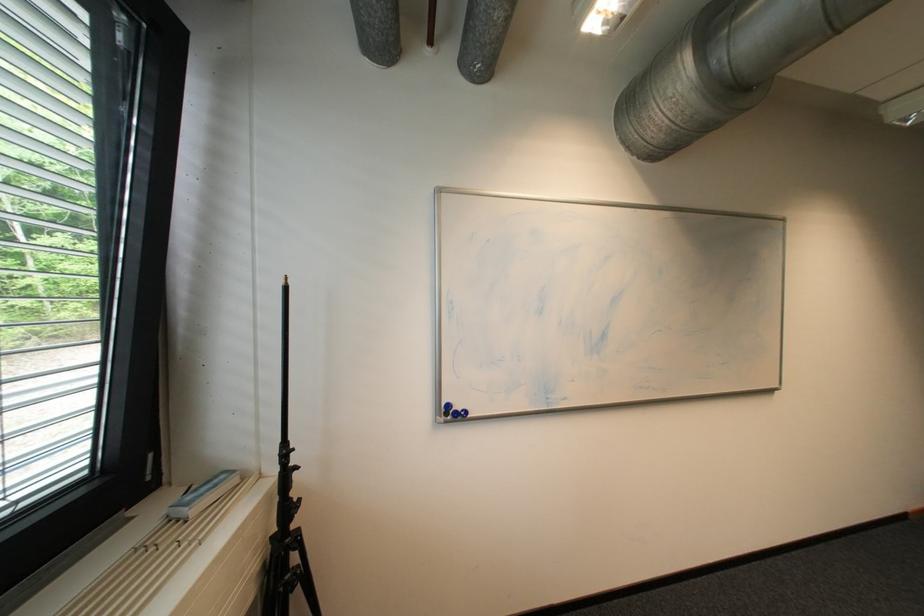
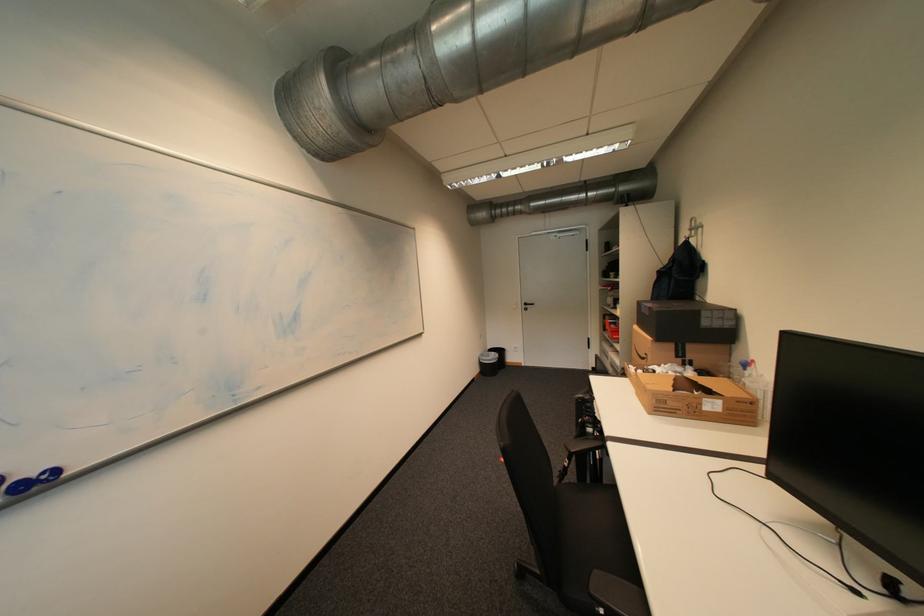
Question: How did the camera likely rotate?

Choices:
 (A) Left
 (B) Right
 (C) Up
 (D) Down

Answer: (B)